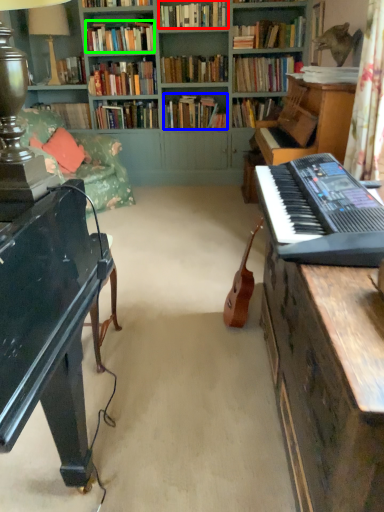
Question: Considering the real-world distances, which object is closest to book (highlighted by a red box)? book (highlighted by a blue box) or book (highlighted by a green box).

Choices:
 (A) book
 (B) book

Answer: (B)